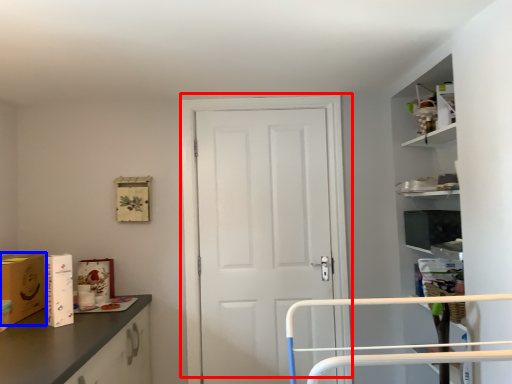
Question: Which of the following is the closest to the observer, door (highlighted by a red box) or cardboard box (highlighted by a blue box)?

Choices:
 (A) door
 (B) cardboard box

Answer: (B)